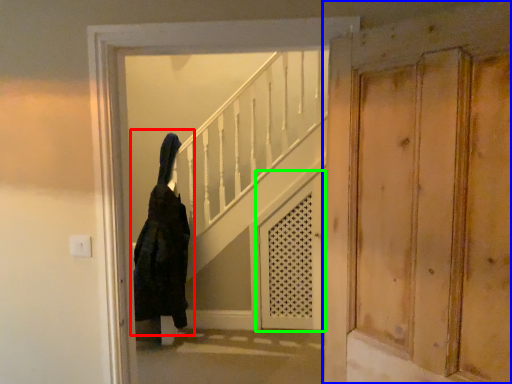
Question: Which object is positioned farthest from woman (highlighted by a red box)? Select from door (highlighted by a blue box) and screen door (highlighted by a green box).

Choices:
 (A) door
 (B) screen door

Answer: (A)